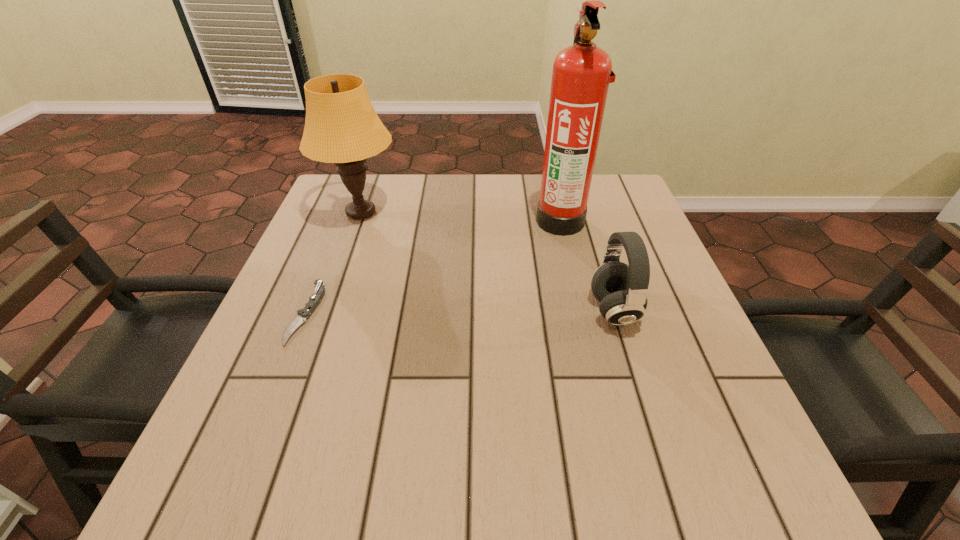
Identify the location of vacant space at the far edge of the desktop. (403, 178).

The image size is (960, 540). I want to click on free spot at the near edge of the desktop, so click(613, 481).

Locate an element on the screen. This screenshot has width=960, height=540. vacant space at the left edge is located at coordinates (351, 311).

Identify the location of free space at the right edge of the desktop. (669, 327).

Where is `free location at the far left corner of the desktop`? free location at the far left corner of the desktop is located at coordinates (371, 195).

In order to click on vacant space at the near left corner of the desktop in this screenshot , I will do `click(234, 493)`.

Image resolution: width=960 pixels, height=540 pixels. I want to click on vacant space at the far right corner of the desktop, so click(x=597, y=216).

Find the location of a particular element. This screenshot has height=540, width=960. free spot at the near right corner of the desktop is located at coordinates (682, 463).

The image size is (960, 540). I want to click on unoccupied area between the second shortest object and the third shortest object, so click(x=488, y=261).

The height and width of the screenshot is (540, 960). Find the location of `vacant region between the third tallest object and the shortest object`. vacant region between the third tallest object and the shortest object is located at coordinates (460, 312).